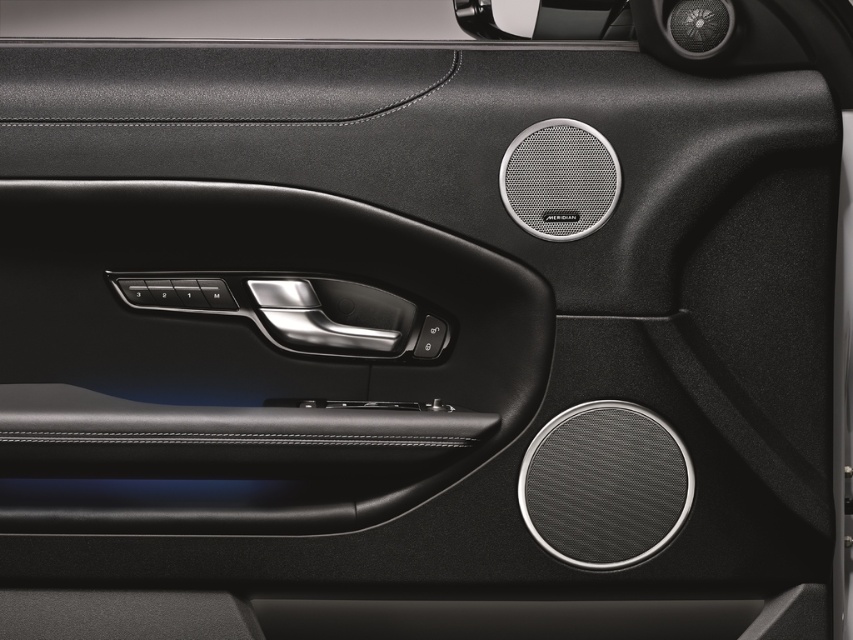
Question: Which point is farther from the camera taking this photo?

Choices:
 (A) (334, 529)
 (B) (418, 337)

Answer: (B)

Question: Among these objects, which one is farthest from the camera?

Choices:
 (A) black leather door handle at center
 (B) black metallic door handle at center

Answer: (B)

Question: Which object is closer to the camera taking this photo?

Choices:
 (A) black leather door handle at center
 (B) black metallic door handle at center

Answer: (A)

Question: Does black leather door handle at center have a lesser width compared to black metallic door handle at center?

Choices:
 (A) no
 (B) yes

Answer: (A)

Question: Is black leather door handle at center smaller than black metallic door handle at center?

Choices:
 (A) no
 (B) yes

Answer: (A)

Question: Does black leather door handle at center appear under black metallic door handle at center?

Choices:
 (A) yes
 (B) no

Answer: (A)